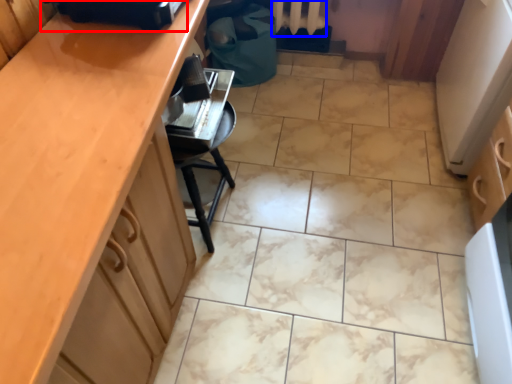
Question: Which of the following is the closest to the observer, appliance (highlighted by a red box) or radiator (highlighted by a blue box)?

Choices:
 (A) appliance
 (B) radiator

Answer: (A)